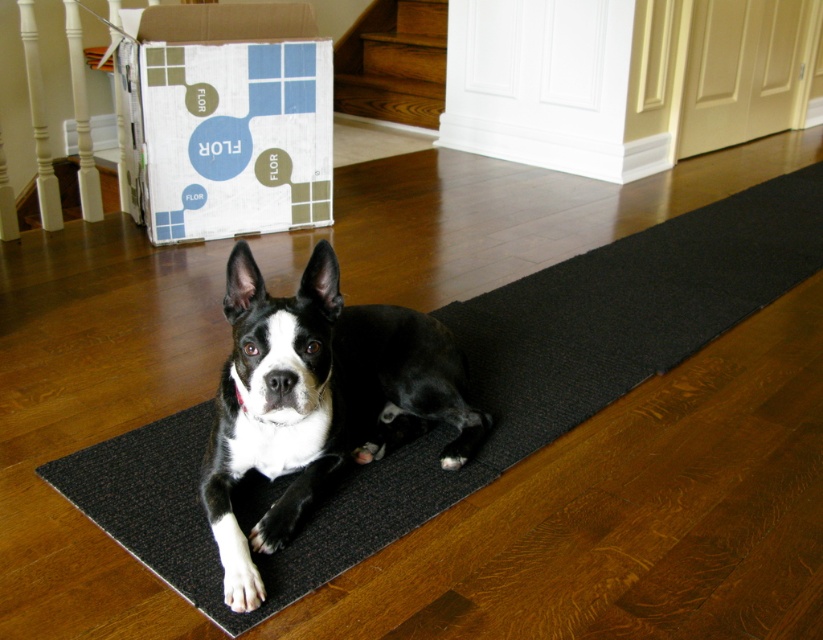
Question: Estimate the real-world distances between objects in this image. Which object is closer to the white cardboard box at upper left?

Choices:
 (A) black matte dog at center
 (B) black rubber mat at center

Answer: (B)

Question: Does black rubber mat at center come behind white cardboard box at upper left?

Choices:
 (A) yes
 (B) no

Answer: (B)

Question: Does black rubber mat at center have a greater width compared to black matte dog at center?

Choices:
 (A) yes
 (B) no

Answer: (A)

Question: Based on their relative distances, which object is nearer to the black matte dog at center?

Choices:
 (A) black rubber mat at center
 (B) white cardboard box at upper left

Answer: (A)

Question: Which of the following is the closest to the observer?

Choices:
 (A) black matte dog at center
 (B) white cardboard box at upper left

Answer: (A)

Question: Is black rubber mat at center thinner than white cardboard box at upper left?

Choices:
 (A) no
 (B) yes

Answer: (A)